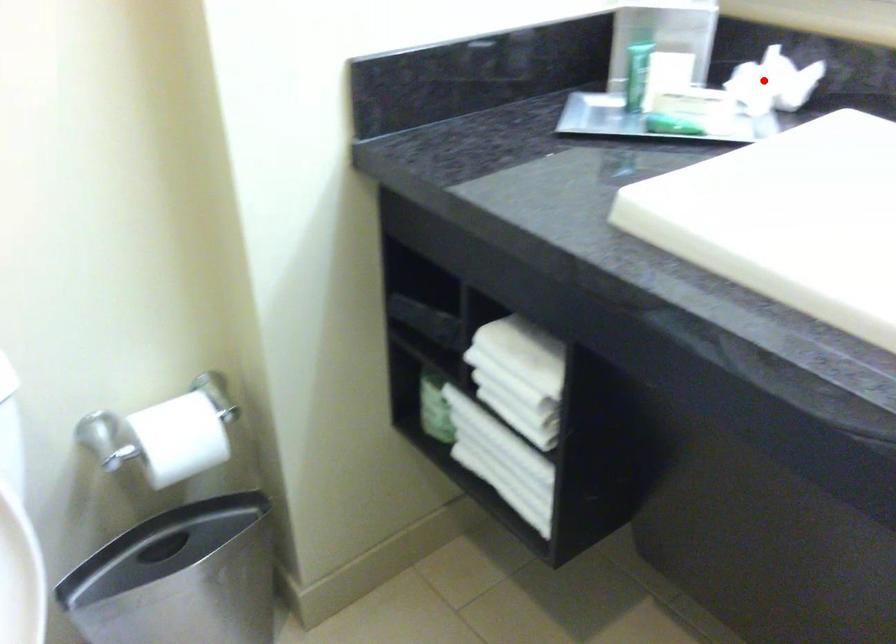
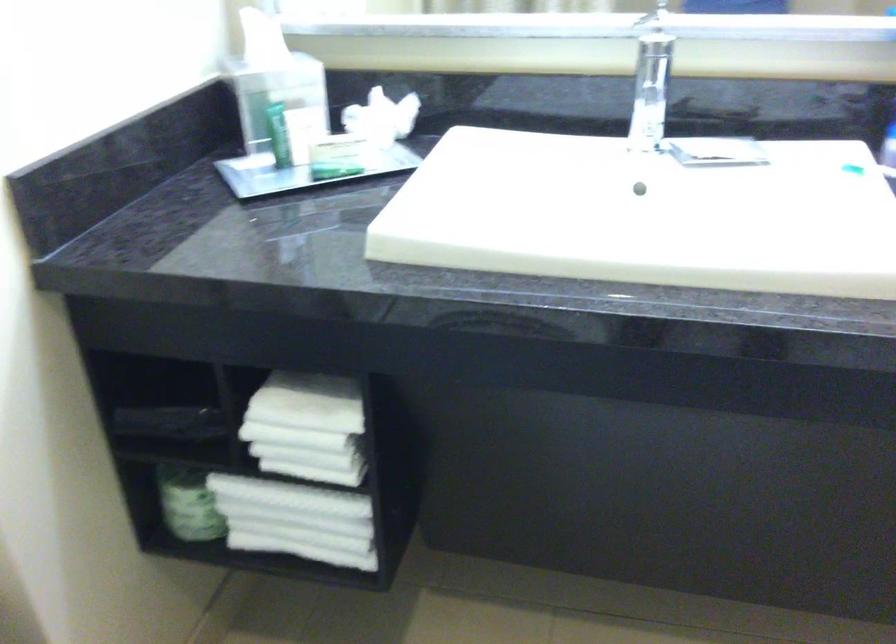
Question: I am providing you with two images of the same scene from different viewpoints. Given a red point in image1, look at the same physical point in image2. Is it:

Choices:
 (A) Closer to the viewpoint
 (B) Farther from the viewpoint

Answer: (B)